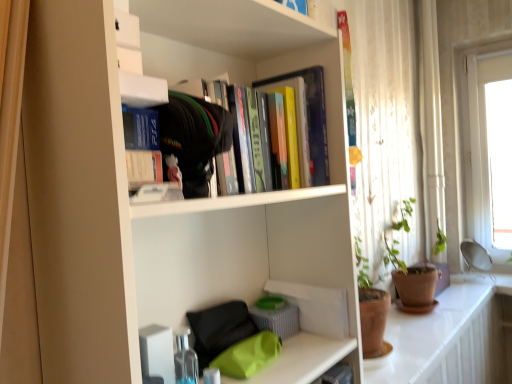
Question: Would you say white glossy counter top at lower right is to the left or to the right of matte gray basket at center in the picture?

Choices:
 (A) left
 (B) right

Answer: (B)

Question: Considering the positions of white glossy counter top at lower right and matte gray basket at center in the image, is white glossy counter top at lower right taller or shorter than matte gray basket at center?

Choices:
 (A) short
 (B) tall

Answer: (A)

Question: Estimate the real-world distances between objects in this image. Which object is farther from the matte gray basket at center?

Choices:
 (A) white sheer curtain at right
 (B) white matte paperback book at upper center
 (C) white glossy counter top at lower right
 (D) matte black ps4 case at upper center, which is counted as the first book, starting from the left
 (E) matte plastic toy at upper center

Answer: (A)

Question: Which of these objects is positioned farthest from the matte gray basket at center?

Choices:
 (A) white glossy counter top at lower right
 (B) matte plastic toy at upper center
 (C) matte black ps4 case at upper center, which is counted as the first book, starting from the front
 (D) hardcover books at upper center, which is the second book from front to back
 (E) white matte bookcase at upper center

Answer: (A)